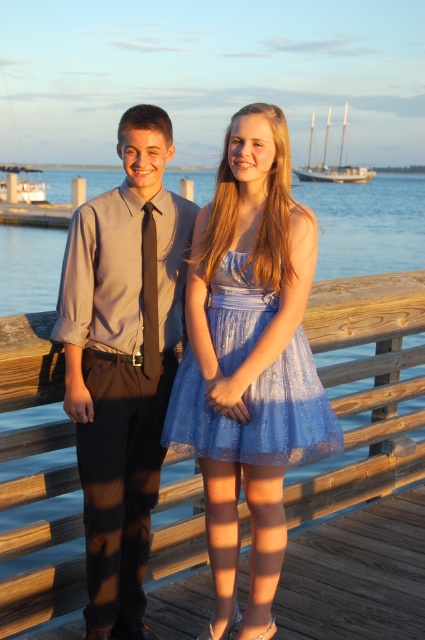
In the scene shown: You are a photographer positioned behind the two people on the pier. You want to capture a photo where the blue lace dress at center is in focus while keeping the shiny blue tulle dress at center slightly blurred in the background. Is this possible based on their current positions?

Yes, since the blue lace dress at center is closer to the viewer than the shiny blue tulle dress at center, adjusting the camera focus to the closer dress will naturally blur the background dress, achieving the desired effect.

You are a photographer at a prom event. You have two dresses in front of you, the blue lace dress at center and the shiny blue tulle dress at center. The client wants to know which dress takes up more space visually. Which one should you recommend?

The blue lace dress at center is larger in size than the shiny blue tulle dress at center, so it takes up more visual space and should be recommended.

You are organizing a photo shoot and need to ensure that the shiny blue tulle dress at center and the white wooden boat at left are both visible in the frame. Given their sizes, which object should you prioritize positioning closer to the camera to maintain their visibility?

The shiny blue tulle dress at center has a smaller size compared to the white wooden boat at left, so you should prioritize positioning the shiny blue tulle dress at center closer to the camera to ensure it remains visible alongside the larger boat.